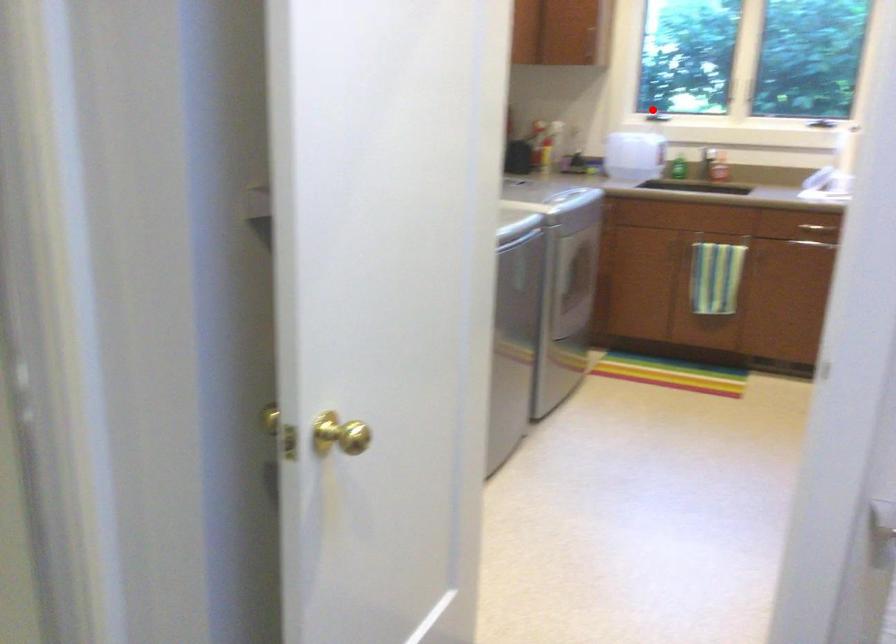
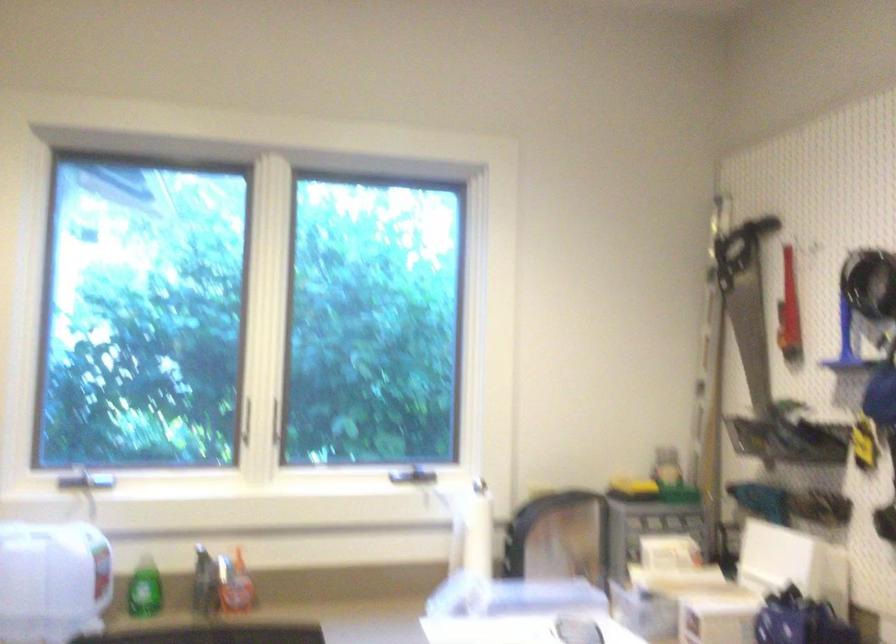
Question: I am providing you with two images of the same scene from different viewpoints. Image1 has a red point marked. In image2, the corresponding 3D location appears at what relative position? Reply with the corresponding letter.

Choices:
 (A) Closer
 (B) Farther

Answer: (A)